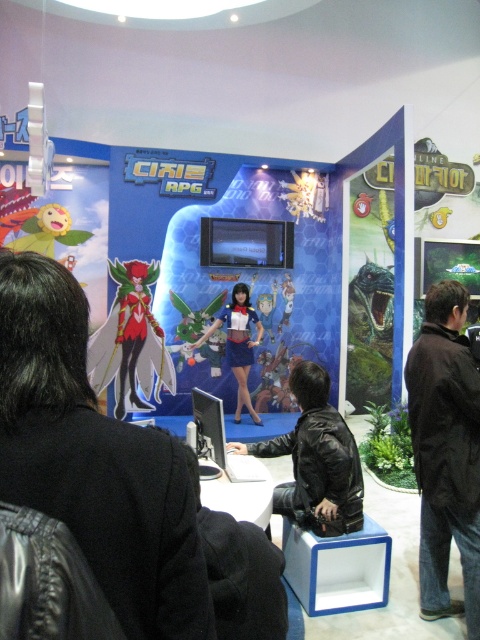
Is shiny metallic figure at center above satin blue dress at center?

Yes.

Does point (133, 323) lie in front of point (229, 330)?

Yes, point (133, 323) is closer to viewer.

You are a GUI agent. You are given a task and a screenshot of the screen. Output one action in this format:
    pyautogui.click(x=<x>, y=<y>)
    Task: Click on the shiny metallic figure at center
    The image size is (480, 640).
    Given the screenshot: What is the action you would take?
    pyautogui.click(x=131, y=340)

Is black leather jacket at right below black leather jacket at center?

No.

Is point (476, 532) farther from camera compared to point (328, 381)?

No, it is not.

Identify the location of black leather jacket at right. (445, 452).

Image resolution: width=480 pixels, height=640 pixels. What do you see at coordinates (445, 452) in the screenshot?
I see `black leather jacket at right` at bounding box center [445, 452].

Is black leather jacket at right shorter than satin blue dress at center?

No.

I want to click on black leather jacket at right, so [x=445, y=452].